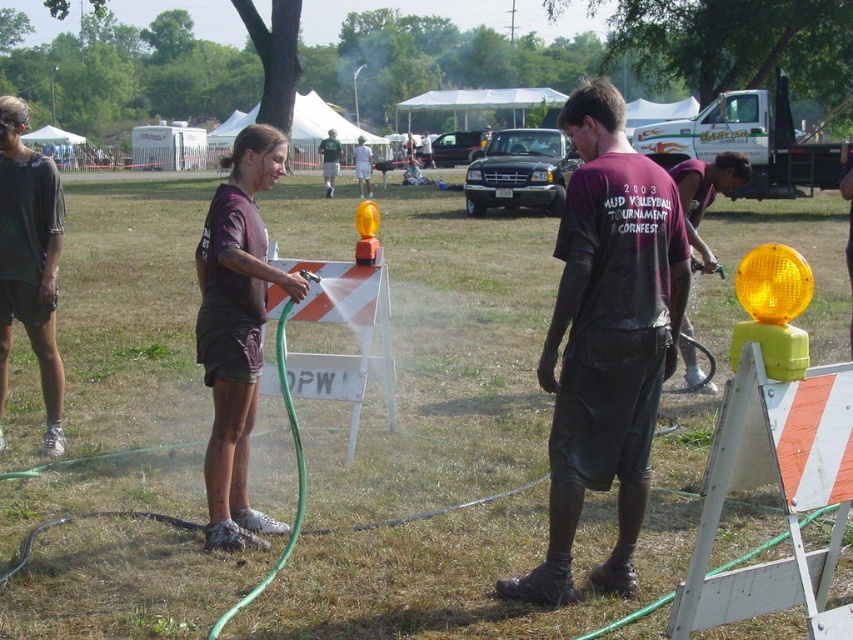
Which is in front, point (639, 413) or point (430, 147)?

Point (639, 413) is more forward.

Find the location of a particular element. This screenshot has width=853, height=640. dark brown mud at center is located at coordinates (606, 339).

Which is behind, point (587, 356) or point (335, 156)?

Positioned behind is point (335, 156).

In the scene shown: Can you confirm if dark brown mud at center is positioned above green fabric shirt at center?

Incorrect, dark brown mud at center is not positioned above green fabric shirt at center.

This screenshot has width=853, height=640. I want to click on dark brown mud at center, so click(606, 339).

In the scene shown: Is matte purple shirt at center to the right of dark brown shorts at center from the viewer's perspective?

Incorrect, matte purple shirt at center is not on the right side of dark brown shorts at center.

Is point (202, 273) closer to camera compared to point (425, 156)?

Yes, it is.

Between point (286, 275) and point (432, 168), which one is positioned in front?

Positioned in front is point (286, 275).

The image size is (853, 640). Identify the location of matte purple shirt at center. (236, 330).